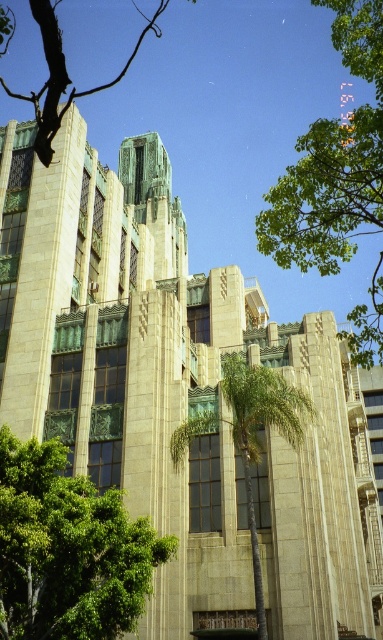
Consider the image. Based on the scene description, where is the green leafy palm tree at center located in the image?

The green leafy palm tree at center is located at point (250, 435) in the image.

You are standing in front of the modernist building and notice a green leafy tree at lower left. Based on its coordinates, is the tree closer to the left edge or the right edge of the image?

The green leafy tree at lower left is located at point 0.859 on the x and y axes. Since the x coordinate is close to 1, it is closer to the right edge of the image.